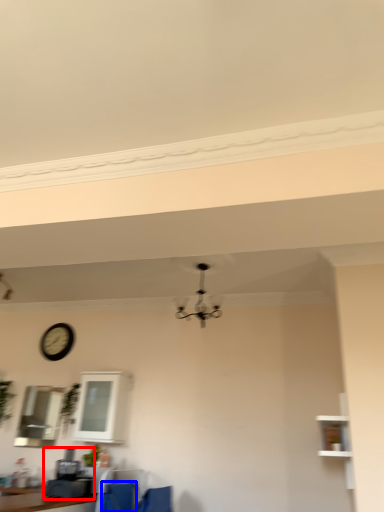
Question: Which object appears closest to the camera in this image, coffee machine (highlighted by a red box) or feeding chair (highlighted by a blue box)?

Choices:
 (A) coffee machine
 (B) feeding chair

Answer: (A)